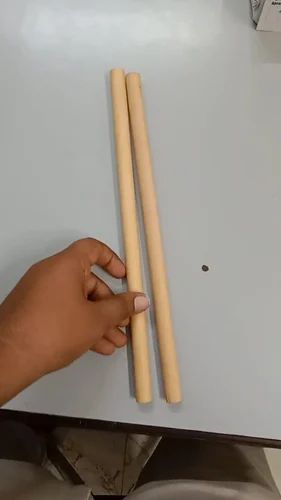
Find the location of a particular element. The height and width of the screenshot is (500, 281). underneath table is located at coordinates (201, 447).